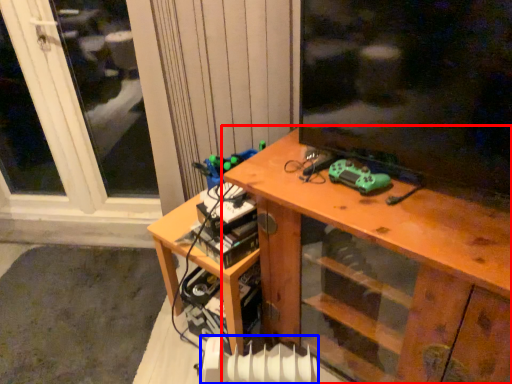
Question: Among these objects, which one is farthest to the camera, desk (highlighted by a red box) or radiator (highlighted by a blue box)?

Choices:
 (A) desk
 (B) radiator

Answer: (B)